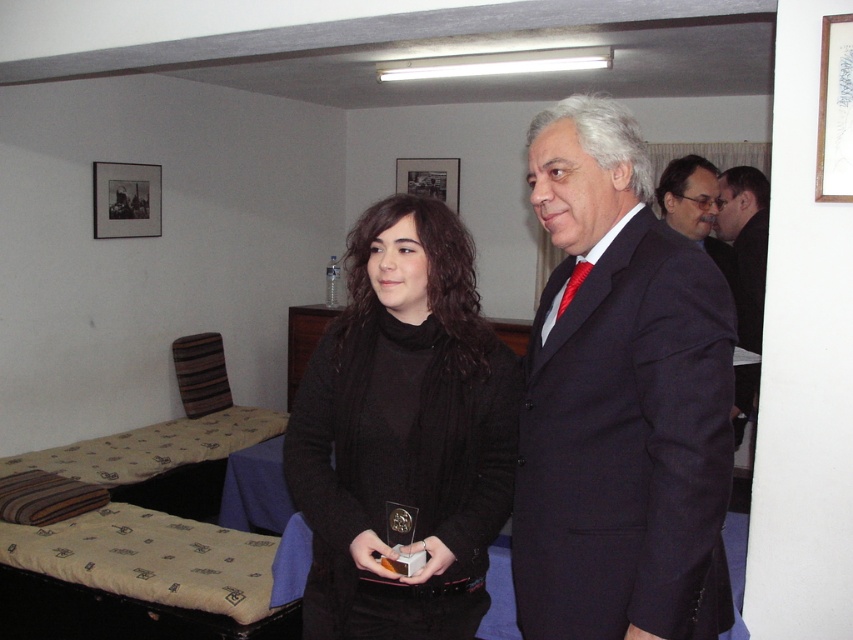
Question: Can you confirm if dark blue suit at center is positioned above black matte picture frame at upper center?

Choices:
 (A) no
 (B) yes

Answer: (A)

Question: Does dark suit at right appear over black matte picture frame at upper center?

Choices:
 (A) no
 (B) yes

Answer: (A)

Question: Which object appears farthest from the camera in this image?

Choices:
 (A) black matte picture frame at upper center
 (B) matte black coat at center

Answer: (A)

Question: Which point is closer to the camera taking this photo?

Choices:
 (A) (753, 387)
 (B) (432, 195)

Answer: (A)

Question: Which of the following is the closest to the observer?

Choices:
 (A) black knitted sweater at center
 (B) matte black coat at center
 (C) matte black picture frame at upper left
 (D) black matte picture frame at upper center

Answer: (B)

Question: From the image, what is the correct spatial relationship of matte black coat at center in relation to matte black picture frame at upper left?

Choices:
 (A) below
 (B) above

Answer: (A)